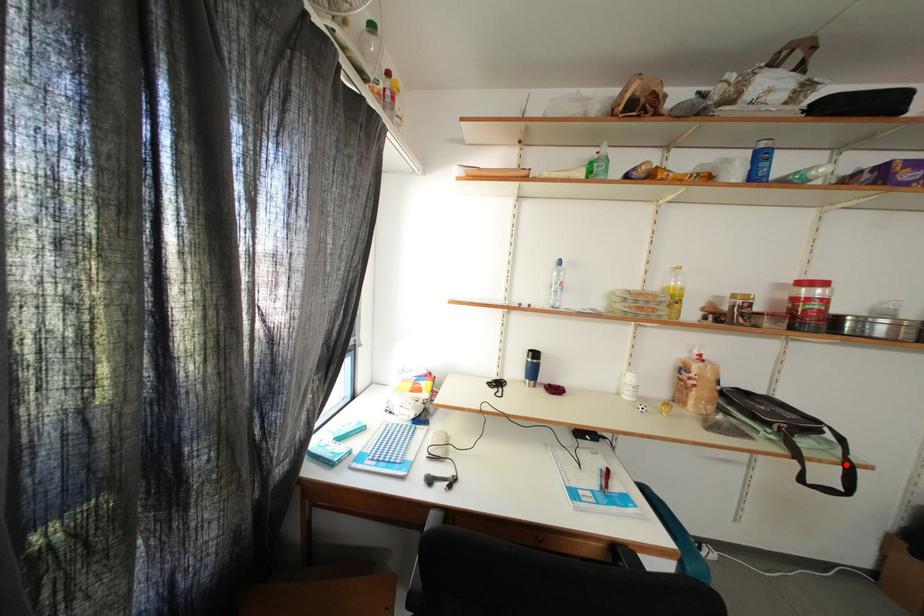
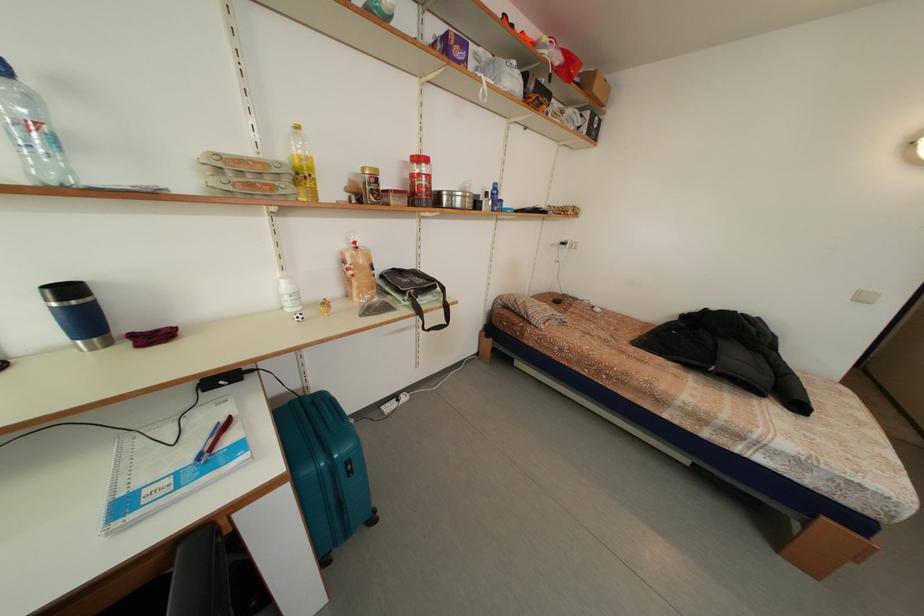
Question: I am providing you with two images of the same scene from different viewpoints. Given a red point in image1, look at the same physical point in image2. Is it:

Choices:
 (A) Closer to the viewpoint
 (B) Farther from the viewpoint

Answer: (B)